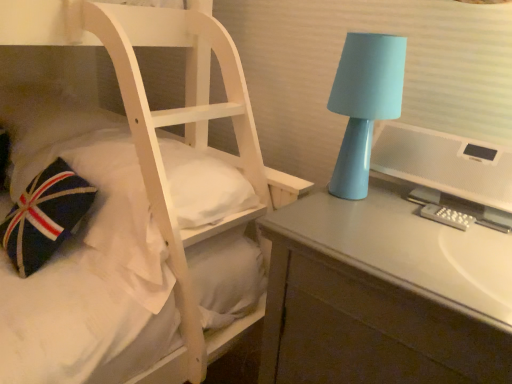
Question: In terms of height, does matte gray desk at right look taller or shorter compared to white textured computer monitor at right?

Choices:
 (A) tall
 (B) short

Answer: (A)

Question: From the image's perspective, relative to white textured computer monitor at right, is matte gray desk at right above or below?

Choices:
 (A) below
 (B) above

Answer: (A)

Question: Which object is positioned farthest from the matte gray desk at right?

Choices:
 (A) matte blue lamp at right
 (B) white textured computer monitor at right

Answer: (A)

Question: Considering the real-world distances, which object is closest to the white textured computer monitor at right?

Choices:
 (A) matte blue lamp at right
 (B) matte gray desk at right

Answer: (A)